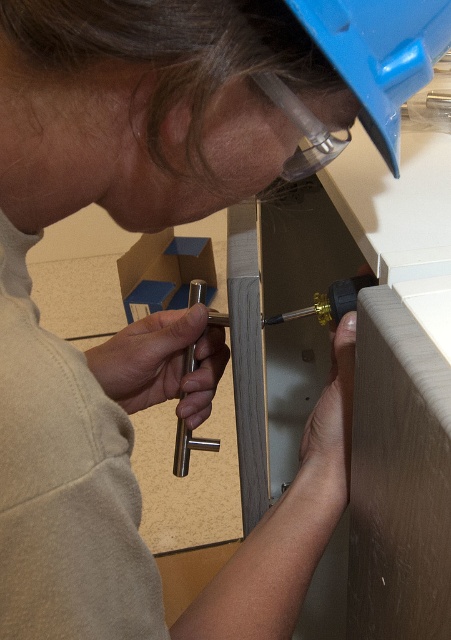
You are a safety inspector checking the workspace. You notice the blue plastic helmet at upper center and the gold metallic screwdriver at center. Which object is closer to the inspector in this setup?

The blue plastic helmet at upper center is closer to the inspector because it is positioned in front of the gold metallic screwdriver at center.

You are a safety inspector checking the workspace. You see the blue plastic helmet at upper center and the gold metallic screwdriver at center. Which object is located higher up in the image?

The blue plastic helmet at upper center is located higher up in the image than the gold metallic screwdriver at center.

You are a safety inspector checking the workspace. You notice the blue plastic helmet at upper center and the gold metallic screwdriver at center. Which object is smaller in size?

The blue plastic helmet at upper center has a smaller size compared to the gold metallic screwdriver at center.